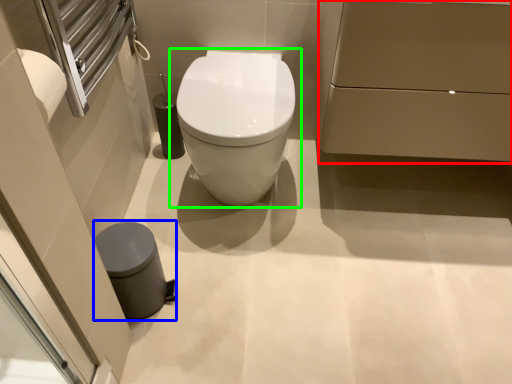
Question: Which is nearer to the porcelain (highlighted by a red box)? porcelain (highlighted by a blue box) or toilet (highlighted by a green box).

Choices:
 (A) porcelain
 (B) toilet

Answer: (B)